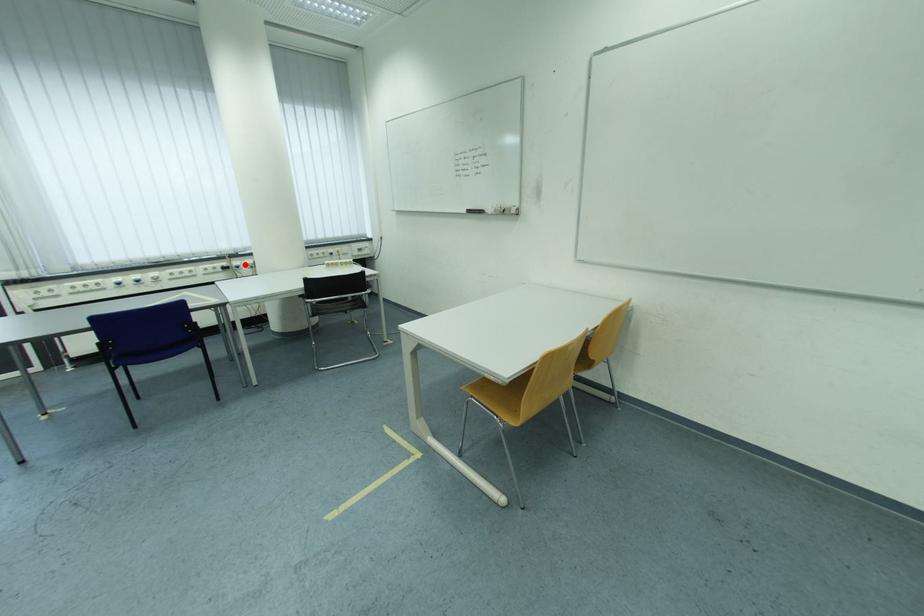
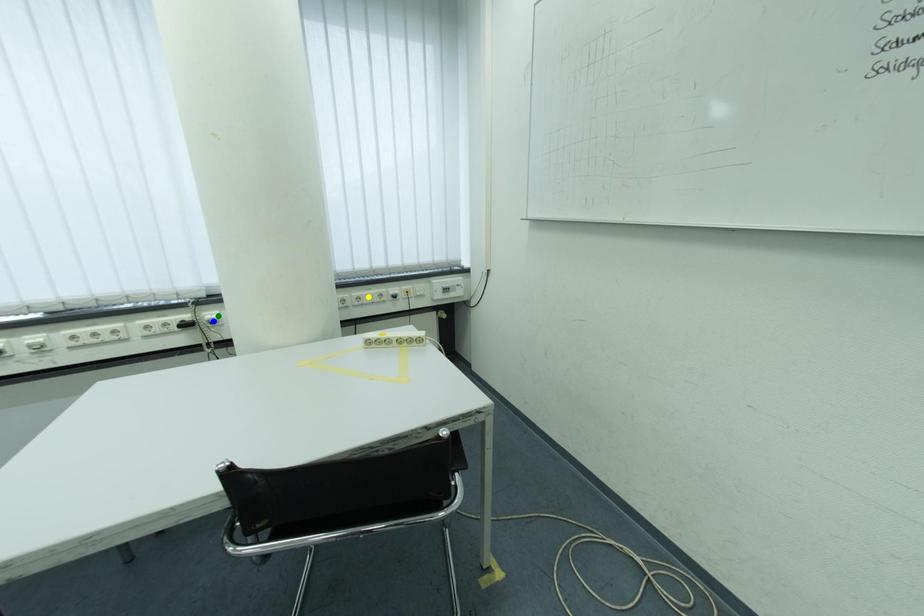
Question: I am providing you with two images of the same scene from different viewpoints. A red point is marked on the first image. You are given multiple points on the second image. Which point in image 2 is actually the same real-world point as the red point in image 1?

Choices:
 (A) yellow point
 (B) green point
 (C) blue point

Answer: (B)